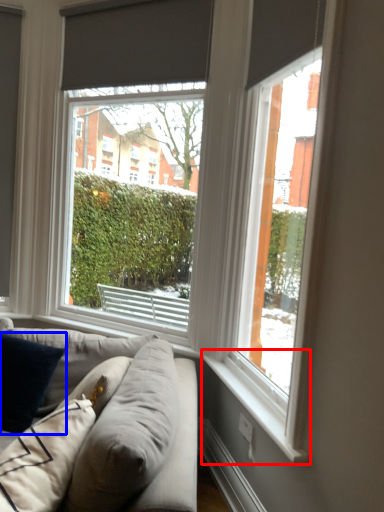
Question: Which point is further to the camera, window sill (highlighted by a red box) or pillow (highlighted by a blue box)?

Choices:
 (A) window sill
 (B) pillow

Answer: (B)